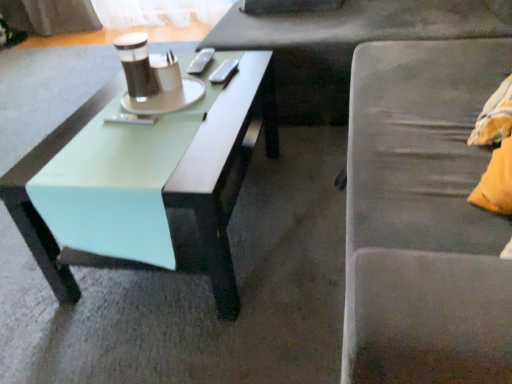
Where is `empty space that is ontop of mint green wood coffee table at left (from a real-world perspective)`? Image resolution: width=512 pixels, height=384 pixels. empty space that is ontop of mint green wood coffee table at left (from a real-world perspective) is located at coordinates (140, 114).